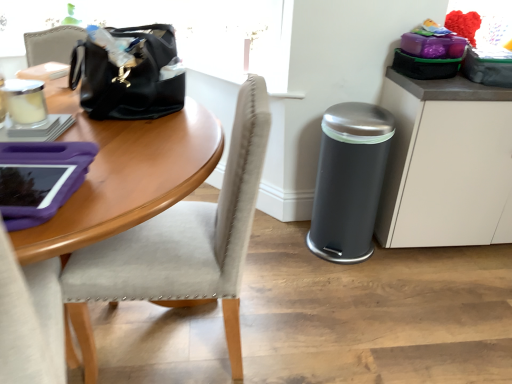
Identify the location of free location in front of matte gray cabinet at right. (452, 297).